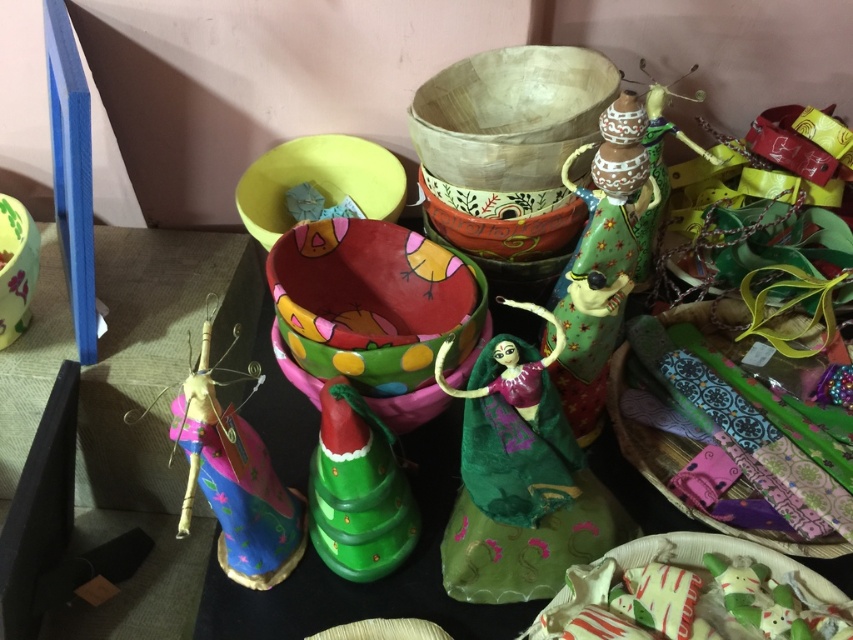
Can you confirm if matte wood doll at left is taller than textured fabric bag at right?

Yes.

Is point (268, 579) in front of point (788, 436)?

Yes, point (268, 579) is in front of point (788, 436).

The image size is (853, 640). I want to click on matte wood doll at left, so click(235, 477).

Can you confirm if green fabric doll at center is smaller than matte wood doll at left?

Yes, green fabric doll at center is smaller than matte wood doll at left.

Looking at this image, between green fabric doll at center and matte wood doll at left, which one appears on the right side from the viewer's perspective?

green fabric doll at center is more to the right.

Who is more distant from viewer, (531,458) or (206,428)?

The point (531,458) is behind.

Locate an element on the screen. green fabric doll at center is located at coordinates (514, 429).

Does green painted wood at center have a greater width compared to green fabric doll at center?

Incorrect, green painted wood at center's width does not surpass green fabric doll at center's.

Which is more to the left, green painted wood at center or green fabric doll at center?

From the viewer's perspective, green fabric doll at center appears more on the left side.

The height and width of the screenshot is (640, 853). What are the coordinates of `green painted wood at center` in the screenshot? It's located at (601, 260).